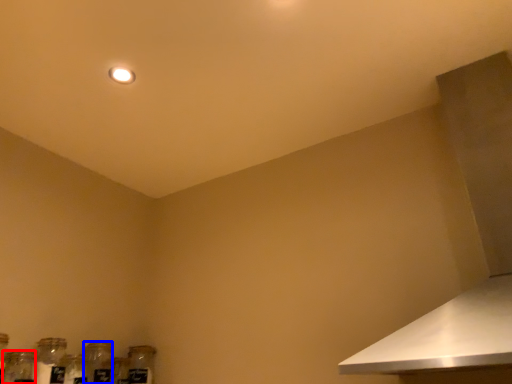
Question: Among these objects, which one is farthest to the camera, glass jar (highlighted by a red box) or bottle (highlighted by a blue box)?

Choices:
 (A) glass jar
 (B) bottle

Answer: (B)